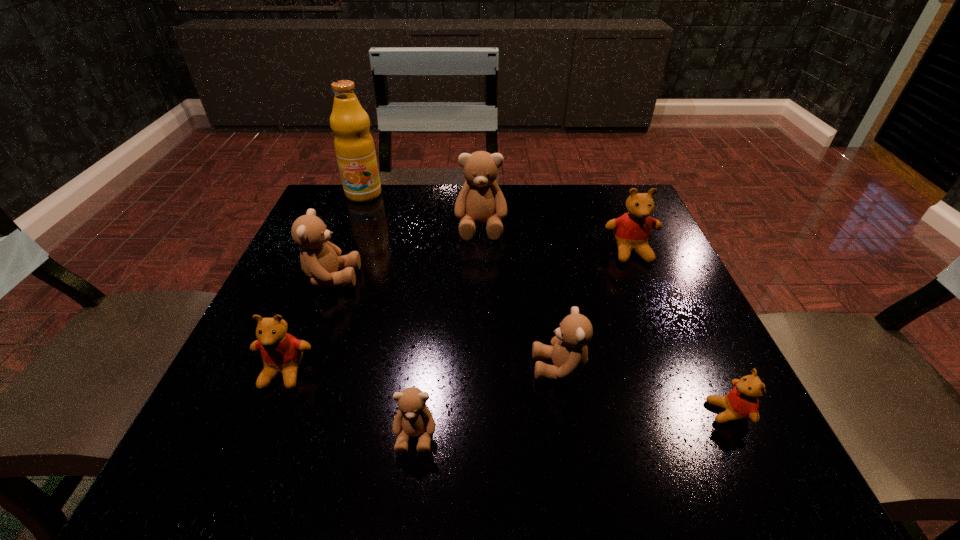
This screenshot has height=540, width=960. I want to click on vacant region between the third smallest brown teddy bear and the smallest brown teddy bear, so click(373, 356).

Where is `vacant area that lies between the third biggest brown teddy bear and the biggest red teddy bear`? The width and height of the screenshot is (960, 540). vacant area that lies between the third biggest brown teddy bear and the biggest red teddy bear is located at coordinates (595, 310).

At what (x,y) coordinates should I click in order to perform the action: click on empty location between the fruit juice and the leftmost brown teddy bear. Please return your answer as a coordinate pair (x, y). Image resolution: width=960 pixels, height=540 pixels. Looking at the image, I should click on (348, 235).

I want to click on free space that is in between the tallest object and the smallest brown teddy bear, so tap(390, 315).

This screenshot has height=540, width=960. I want to click on vacant point located between the second smallest brown teddy bear and the tallest object, so click(462, 281).

Locate an element on the screen. The height and width of the screenshot is (540, 960). blank region between the fifth object from right to left and the second biggest red teddy bear is located at coordinates 349,404.

Locate which object ranks second in proximity to the smallest red teddy bear. Please provide its 2D coordinates. Your answer should be formatted as a tuple, i.e. [(x, y)], where the tuple contains the x and y coordinates of a point satisfying the conditions above.

[(632, 231)]

Select which object appears as the fifth closest to the smallest red teddy bear. Please provide its 2D coordinates. Your answer should be formatted as a tuple, i.e. [(x, y)], where the tuple contains the x and y coordinates of a point satisfying the conditions above.

[(281, 352)]

Identify which teddy bear is the fifth nearest to the second farthest brown teddy bear. Please provide its 2D coordinates. Your answer should be formatted as a tuple, i.e. [(x, y)], where the tuple contains the x and y coordinates of a point satisfying the conditions above.

[(632, 231)]

Image resolution: width=960 pixels, height=540 pixels. What are the coordinates of `the fourth closest teddy bear to the third brown teddy bear from right to left` in the screenshot? It's located at [741, 403].